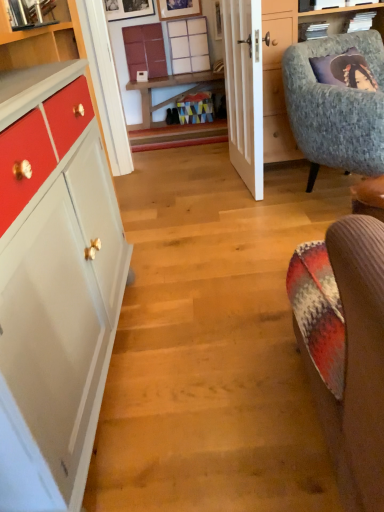
Question: Is textured gray armchair at upper right positioned before white wooden door at center?

Choices:
 (A) no
 (B) yes

Answer: (B)

Question: Is textured gray armchair at upper right bigger than white wooden door at center?

Choices:
 (A) no
 (B) yes

Answer: (B)

Question: From a real-world perspective, is textured gray armchair at upper right physically below white wooden door at center?

Choices:
 (A) no
 (B) yes

Answer: (B)

Question: Considering the relative sizes of textured gray armchair at upper right and white wooden door at center in the image provided, is textured gray armchair at upper right smaller than white wooden door at center?

Choices:
 (A) yes
 (B) no

Answer: (B)

Question: From the image's perspective, is textured gray armchair at upper right under white wooden door at center?

Choices:
 (A) yes
 (B) no

Answer: (A)

Question: From the image's perspective, is white grid shelf at upper center located above or below matte wood counter top at upper left?

Choices:
 (A) above
 (B) below

Answer: (A)

Question: Considering their positions, is white grid shelf at upper center located in front of or behind matte wood counter top at upper left?

Choices:
 (A) front
 (B) behind

Answer: (B)

Question: Is white grid shelf at upper center wider or thinner than matte wood counter top at upper left?

Choices:
 (A) thin
 (B) wide

Answer: (A)

Question: Is white grid shelf at upper center spatially inside matte wood counter top at upper left, or outside of it?

Choices:
 (A) outside
 (B) inside

Answer: (A)

Question: Considering the relative positions of wooden picture frame at upper center, arranged as the second picture frame when viewed from the right, and matte wood cabinet at upper center in the image provided, is wooden picture frame at upper center, arranged as the second picture frame when viewed from the right, to the left or to the right of matte wood cabinet at upper center?

Choices:
 (A) right
 (B) left

Answer: (B)

Question: Relative to matte wood cabinet at upper center, is wooden picture frame at upper center, which is the first picture frame in left-to-right order, in front or behind?

Choices:
 (A) behind
 (B) front

Answer: (B)

Question: From their relative heights in the image, would you say wooden picture frame at upper center, which is the first picture frame in left-to-right order, is taller or shorter than matte wood cabinet at upper center?

Choices:
 (A) tall
 (B) short

Answer: (B)

Question: From a real-world perspective, is wooden picture frame at upper center, which is the first picture frame in left-to-right order, physically located above or below matte wood cabinet at upper center?

Choices:
 (A) below
 (B) above

Answer: (B)

Question: From a real-world perspective, is matte wood cabinet at upper center positioned above or below matte wood counter top at upper left?

Choices:
 (A) below
 (B) above

Answer: (A)

Question: From the image's perspective, relative to matte wood counter top at upper left, is matte wood cabinet at upper center above or below?

Choices:
 (A) above
 (B) below

Answer: (A)